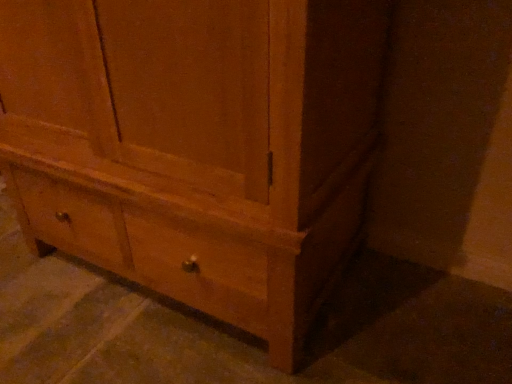
What do you see at coordinates (196, 145) in the screenshot? The image size is (512, 384). I see `matte wood chest of drawers at center` at bounding box center [196, 145].

Identify the location of matte wood chest of drawers at center. (196, 145).

The height and width of the screenshot is (384, 512). What are the coordinates of `matte wood chest of drawers at center` in the screenshot? It's located at (196, 145).